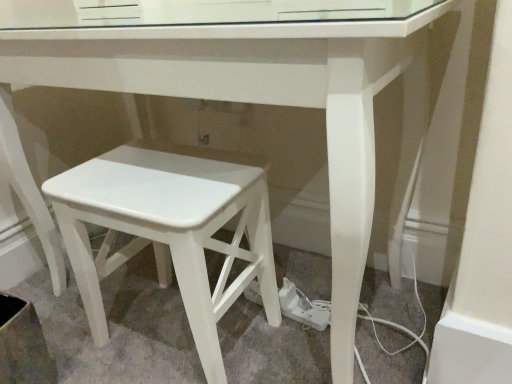
In order to face white painted wood stool at lower left, should I rotate leftwards or rightwards?

Turn left by 11.315 degrees to look at white painted wood stool at lower left.

Identify the location of white painted wood stool at lower left. (170, 229).

The height and width of the screenshot is (384, 512). Describe the element at coordinates (170, 229) in the screenshot. I see `white painted wood stool at lower left` at that location.

At what (x,y) coordinates should I click in order to perform the action: click on white painted wood stool at lower left. Please return your answer as a coordinate pair (x, y). This screenshot has width=512, height=384. Looking at the image, I should click on (170, 229).